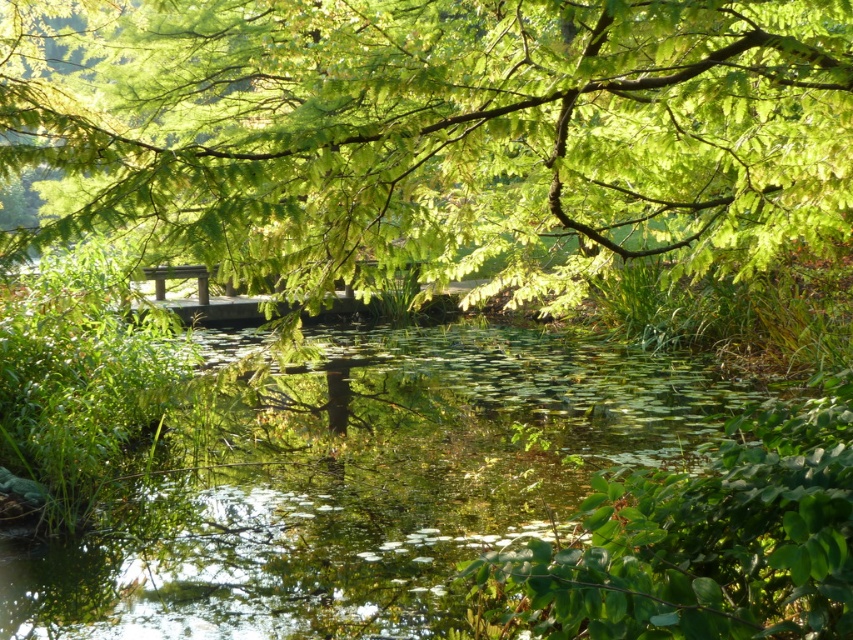
Between green leafy tree at upper center and green leafy water at center, which one is positioned higher?

green leafy tree at upper center is above.

Is green leafy tree at upper center closer to the viewer compared to green leafy water at center?

Yes, green leafy tree at upper center is in front of green leafy water at center.

Where is `green leafy tree at upper center`? This screenshot has height=640, width=853. green leafy tree at upper center is located at coordinates (436, 132).